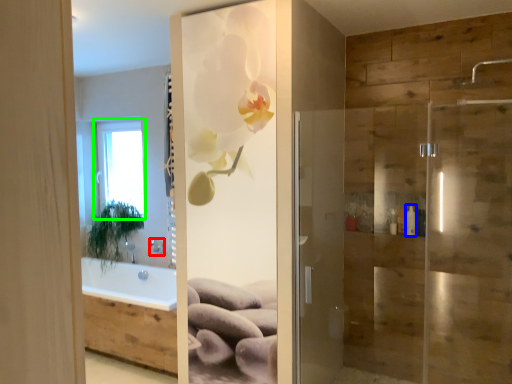
Question: Estimate the real-world distances between objects in this image. Which object is farther from shower (highlighted by a red box), toiletry (highlighted by a blue box) or window (highlighted by a green box)?

Choices:
 (A) toiletry
 (B) window

Answer: (A)